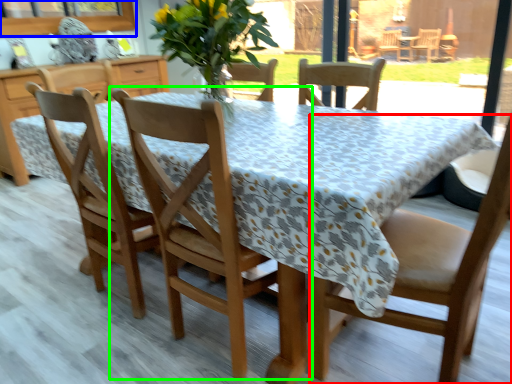
Question: Based on their relative distances, which object is nearer to chair (highlighted by a red box)? Choose from window screen (highlighted by a blue box) and chair (highlighted by a green box).

Choices:
 (A) window screen
 (B) chair

Answer: (B)